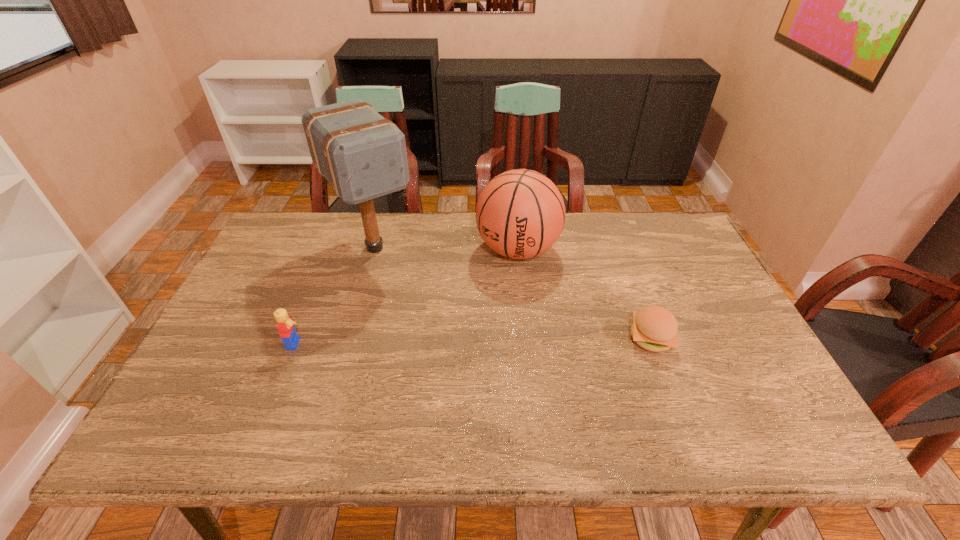
You are a GUI agent. You are given a task and a screenshot of the screen. Output one action in this format:
    pyautogui.click(x=<x>, y=<y>)
    Task: Click on the object that can be found as the third closest to the third shortest object
    This screenshot has height=540, width=960.
    Given the screenshot: What is the action you would take?
    pyautogui.click(x=286, y=327)

Identify which object is located as the third nearest to the third object from left to right. Please provide its 2D coordinates. Your answer should be formatted as a tuple, i.e. [(x, y)], where the tuple contains the x and y coordinates of a point satisfying the conditions above.

[(286, 327)]

Where is `free space that satisfies the following two spatial constraints: 1. on the front side of the tallest object; 2. on the left side of the shortest object`? free space that satisfies the following two spatial constraints: 1. on the front side of the tallest object; 2. on the left side of the shortest object is located at coordinates (349, 338).

The height and width of the screenshot is (540, 960). In order to click on vacant space that satisfies the following two spatial constraints: 1. on the front side of the third object from left to right; 2. on the right side of the mallet in this screenshot , I will do tap(374, 249).